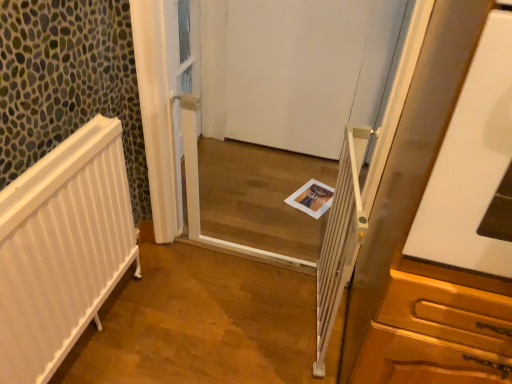
Where is `free space between white matte radiator at left and white plastic balustrade at center`? Image resolution: width=512 pixels, height=384 pixels. free space between white matte radiator at left and white plastic balustrade at center is located at coordinates (208, 320).